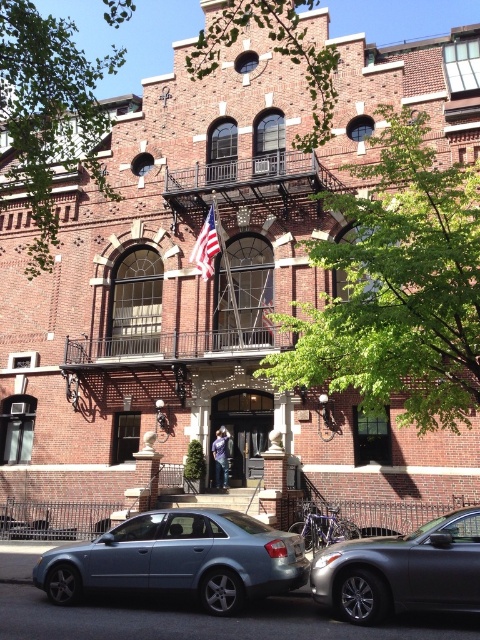
You are a visitor arriving at the building and want to park your car. The satin blue sedan at lower center is blocking the path to the entrance steps. Can you drive around it to reach the steps without going under the american flag at center?

The satin blue sedan at lower center is positioned under the american flag at center, so driving around it might require passing under the flag. However, since the flag is attached to the building, you cannot drive under it. Therefore, you need to move the sedan to access the entrance steps safely.

You are a visitor arriving at the brick building and see the satin blue sedan at lower center and the metallic gray sedan at lower right. Which car is parked closer to the entrance steps?

The satin blue sedan at lower center is parked closer to the entrance steps because it is located below the metallic gray sedan at lower right, indicating a lower position relative to the entrance.